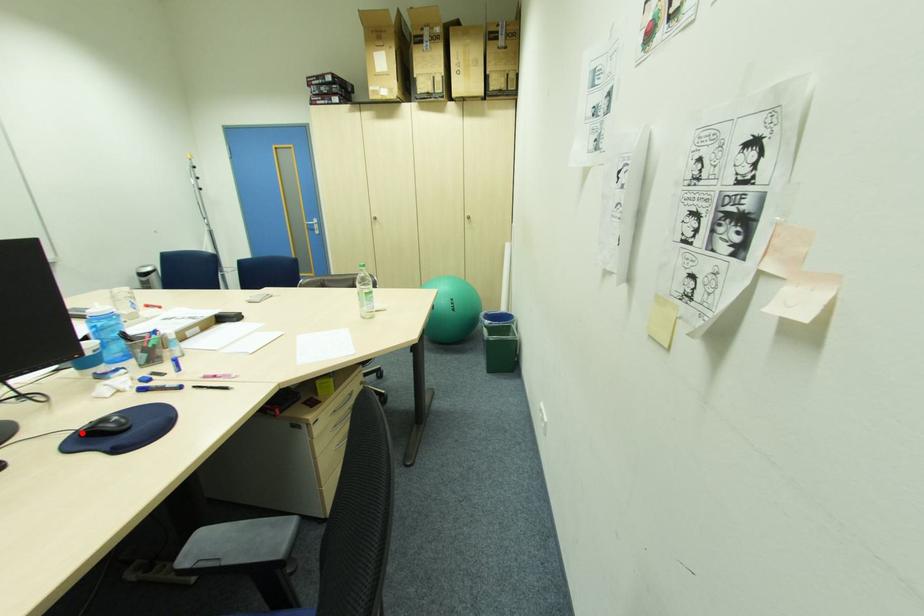
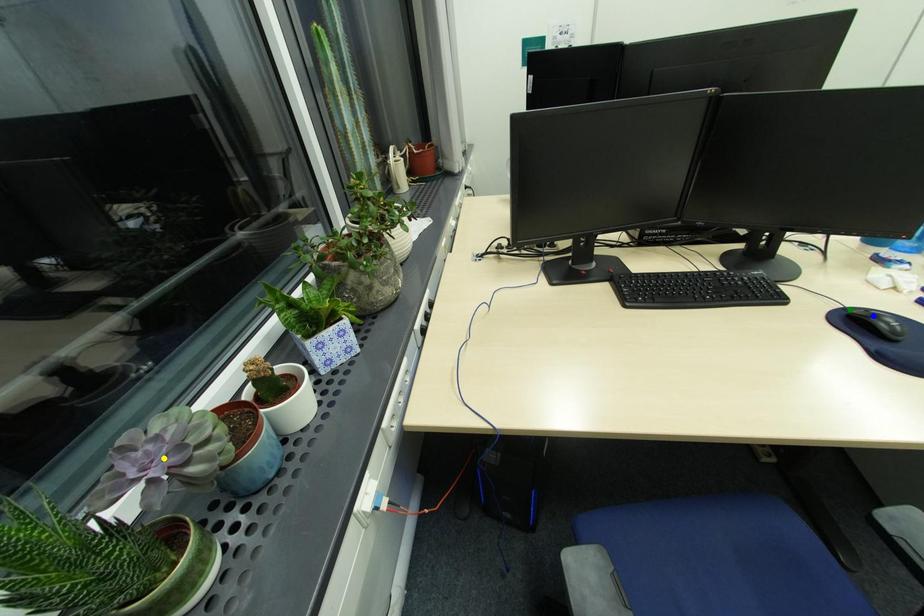
Question: I am providing you with two images of the same scene from different viewpoints. A red point is marked on the first image. You are given multiple points on the second image. Can you choose the point in image 2 that corresponds to the point in image 1?

Choices:
 (A) blue point
 (B) yellow point
 (C) green point

Answer: (C)